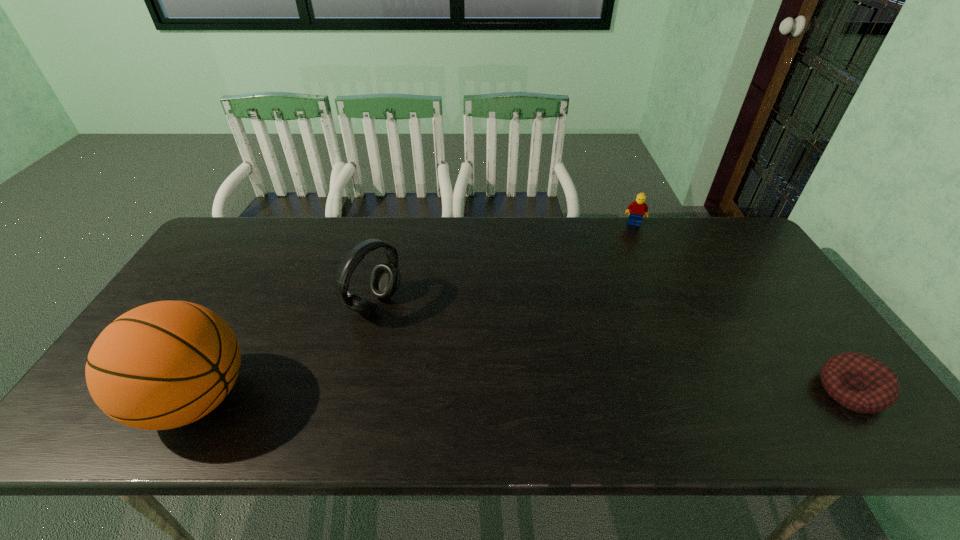
Identify the location of free region located on the earcups of the second tallest object. (418, 329).

The height and width of the screenshot is (540, 960). In order to click on free space located on the earcups of the second tallest object in this screenshot , I will do `click(488, 366)`.

Locate an element on the screen. vacant space situated on the earcups of the second tallest object is located at coordinates (412, 326).

Where is `vacant area situated on the front-facing side of the farthest object`? The image size is (960, 540). vacant area situated on the front-facing side of the farthest object is located at coordinates (628, 290).

Locate an element on the screen. This screenshot has width=960, height=540. free spot located 0.050m on the front-facing side of the farthest object is located at coordinates (632, 235).

The image size is (960, 540). What are the coordinates of `vacant space located 0.140m on the front-facing side of the farthest object` in the screenshot? It's located at (631, 251).

I want to click on object that is positioned at the far edge, so click(x=636, y=209).

In order to click on basketball present at the near edge in this screenshot , I will do `click(166, 364)`.

You are a GUI agent. You are given a task and a screenshot of the screen. Output one action in this format:
    pyautogui.click(x=<x>, y=<y>)
    Task: Click on the beanbag present at the near edge
    This screenshot has height=540, width=960.
    Given the screenshot: What is the action you would take?
    pyautogui.click(x=859, y=382)

You are a GUI agent. You are given a task and a screenshot of the screen. Output one action in this format:
    pyautogui.click(x=<x>, y=<y>)
    Task: Click on the object at the left edge
    
    Given the screenshot: What is the action you would take?
    pyautogui.click(x=166, y=364)